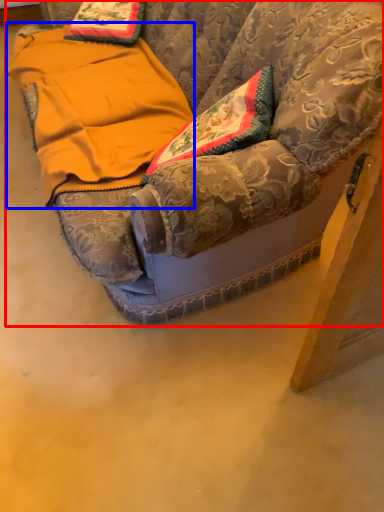
Question: Among these objects, which one is nearest to the camera, furniture (highlighted by a red box) or blanket (highlighted by a blue box)?

Choices:
 (A) furniture
 (B) blanket

Answer: (A)